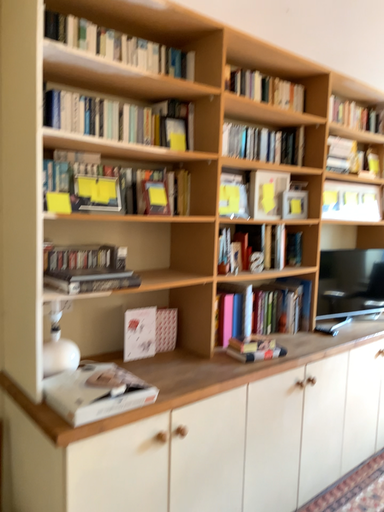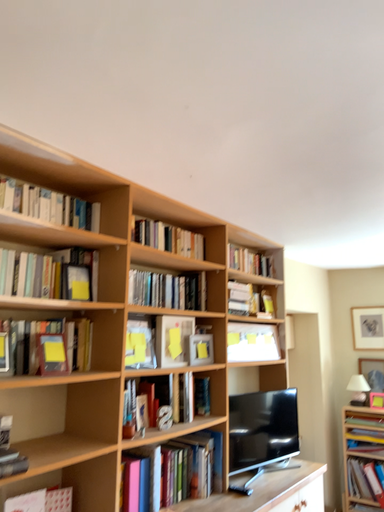
Question: How did the camera likely rotate when shooting the video?

Choices:
 (A) rotated downward
 (B) rotated upward

Answer: (B)